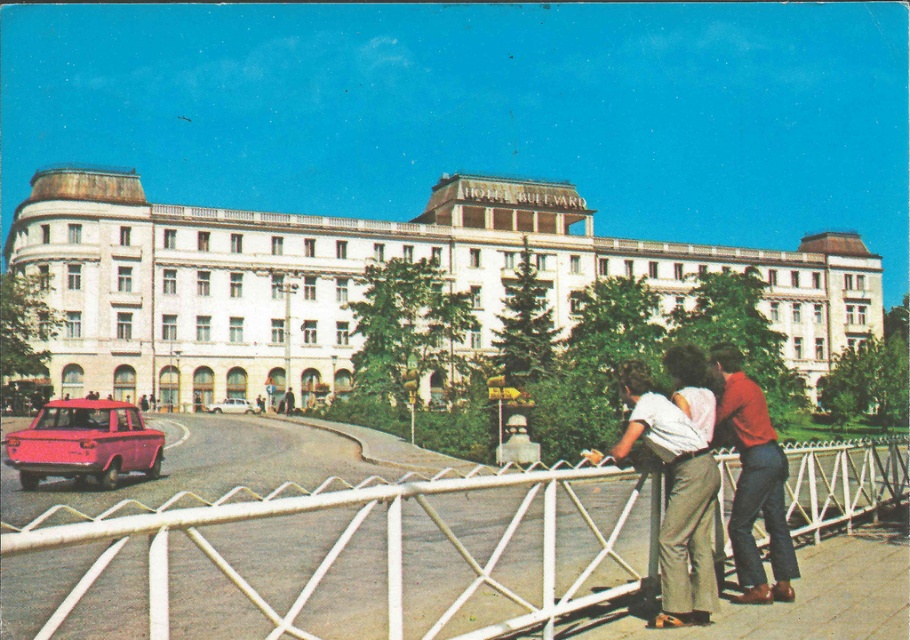
Can you confirm if matte white pants at center is positioned to the left of matte pink sedan at lower left?

No, matte white pants at center is not to the left of matte pink sedan at lower left.

Can you confirm if matte white pants at center is positioned below matte pink sedan at lower left?

No.

Between point (694, 468) and point (114, 433), which one is positioned in front?

Point (694, 468) is in front.

This screenshot has width=910, height=640. I want to click on matte white pants at center, so click(x=688, y=502).

Is matte pink sedan at lower left wider than white glossy sedan at center?

Indeed, matte pink sedan at lower left has a greater width compared to white glossy sedan at center.

Does matte pink sedan at lower left appear on the left side of white glossy sedan at center?

Yes, matte pink sedan at lower left is to the left of white glossy sedan at center.

Is point (88, 442) farther from camera compared to point (248, 408)?

No, it is in front of (248, 408).

This screenshot has height=640, width=910. Find the location of `matte pink sedan at lower left`. matte pink sedan at lower left is located at coordinates (84, 442).

Who is more distant from viewer, (231, 522) or (39, 440)?

The point (39, 440) is more distant.

Which is above, white metal fence at lower center or matte pink sedan at lower left?

Positioned higher is matte pink sedan at lower left.

Where is `white metal fence at lower center`? The height and width of the screenshot is (640, 910). white metal fence at lower center is located at coordinates (345, 557).

Find the location of a particular element. The height and width of the screenshot is (640, 910). white metal fence at lower center is located at coordinates (345, 557).